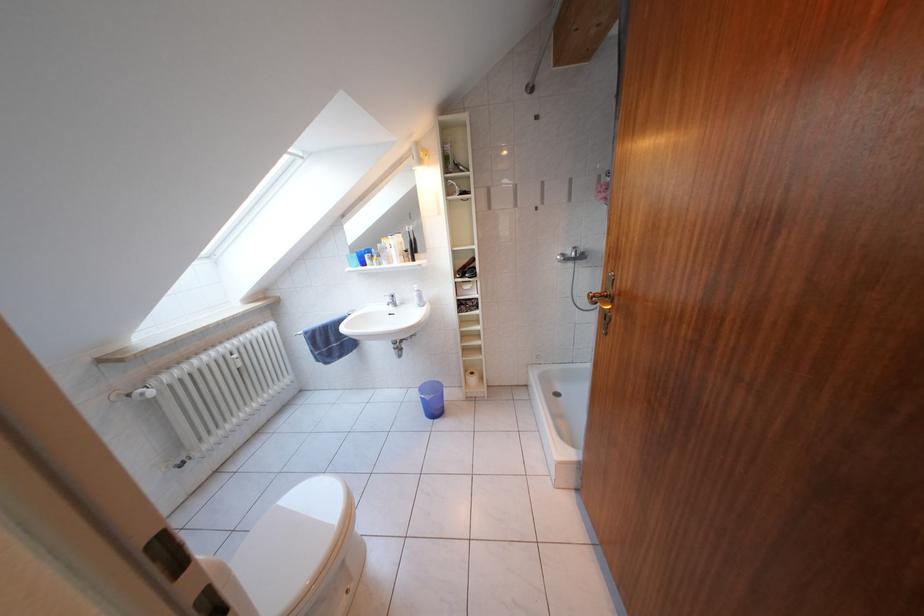
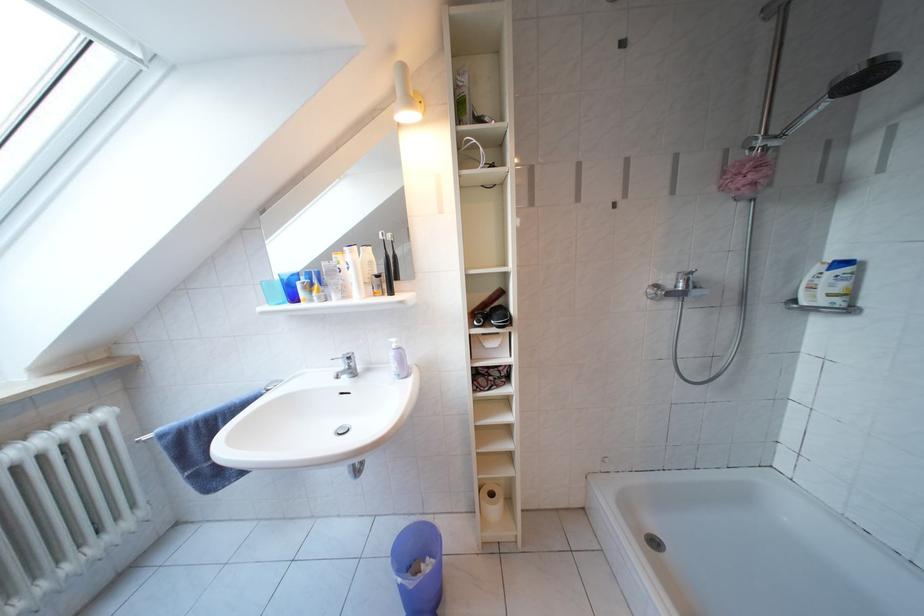
Where in the second image is the point corresponding to (x=424, y=305) from the first image?

(402, 371)